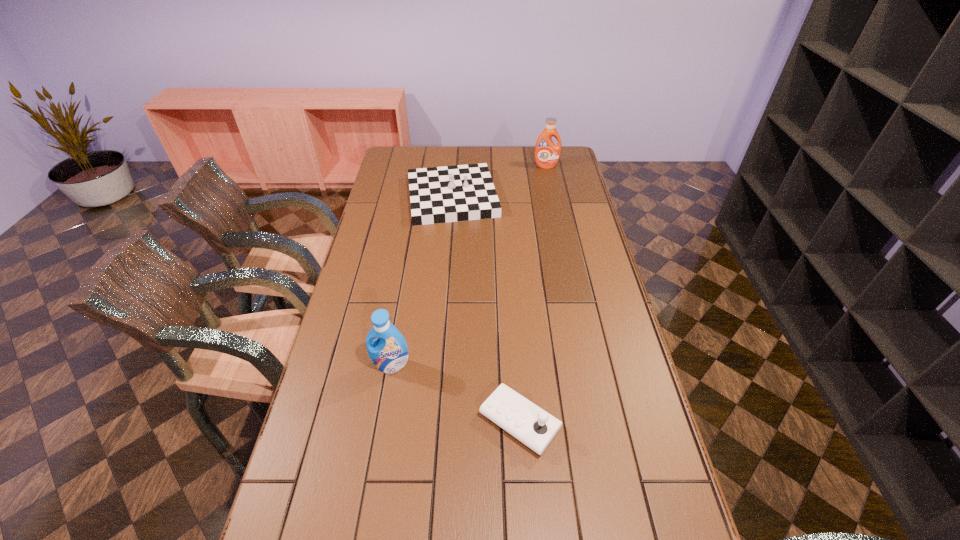
Identify the location of the rightmost object. This screenshot has height=540, width=960. (547, 153).

Identify the location of the farther detergent. This screenshot has width=960, height=540. (x=547, y=153).

Where is `the left detergent`? The height and width of the screenshot is (540, 960). the left detergent is located at coordinates 389,353.

The width and height of the screenshot is (960, 540). I want to click on the second nearest object, so click(389, 353).

Locate an element on the screen. the second farthest object is located at coordinates (446, 194).

Where is `the nearest object`? the nearest object is located at coordinates (531, 425).

The width and height of the screenshot is (960, 540). Find the location of `joystick`. joystick is located at coordinates pyautogui.click(x=531, y=425).

Where is `vacant area situated on the front-facing side of the farther detergent`? The width and height of the screenshot is (960, 540). vacant area situated on the front-facing side of the farther detergent is located at coordinates (550, 186).

I want to click on blank space located 0.100m on the front-facing side of the nearer detergent, so click(x=384, y=405).

The image size is (960, 540). In order to click on vacant area situated 0.240m on the right of the checkerboard in this screenshot , I will do `click(556, 197)`.